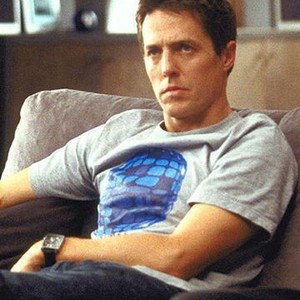
Where is `window`? The image size is (300, 300). window is located at coordinates (122, 15).